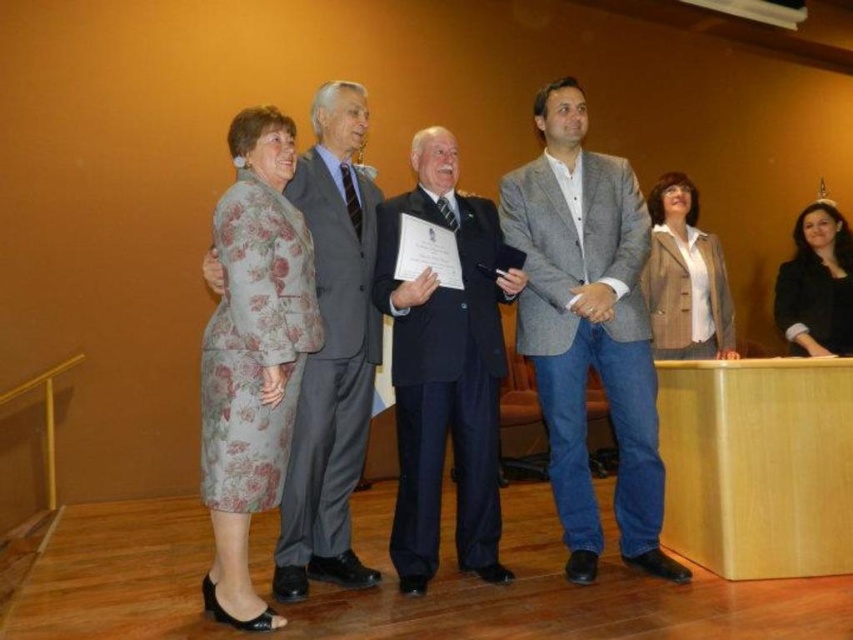
You are an event photographer positioned at the back of the hall. You need to capture a photo where both the floral fabric dress at left and the dark brown leather jacket at upper right are clearly visible. Based on their positions, which object is closer to the camera?

The floral fabric dress at left is below the dark brown leather jacket at upper right, meaning the dark brown leather jacket at upper right is higher in the frame. Since the photographer is at the back, the dark brown leather jacket at upper right is closer to the camera than the floral fabric dress at left.

You are an event photographer at the award ceremony. You need to capture a photo of the floral fabric dress at left and the light brown textured blazer at center. Based on their positions, which one is located to the left of the other?

The floral fabric dress at left is positioned on the left side of the light brown textured blazer at center.

You are an event planner setting up a photo backdrop for the stage. The backdrop needs to be placed at point (685,278). What object should the backdrop be positioned behind?

The backdrop should be positioned behind the light brown textured blazer at center located at point (685,278).